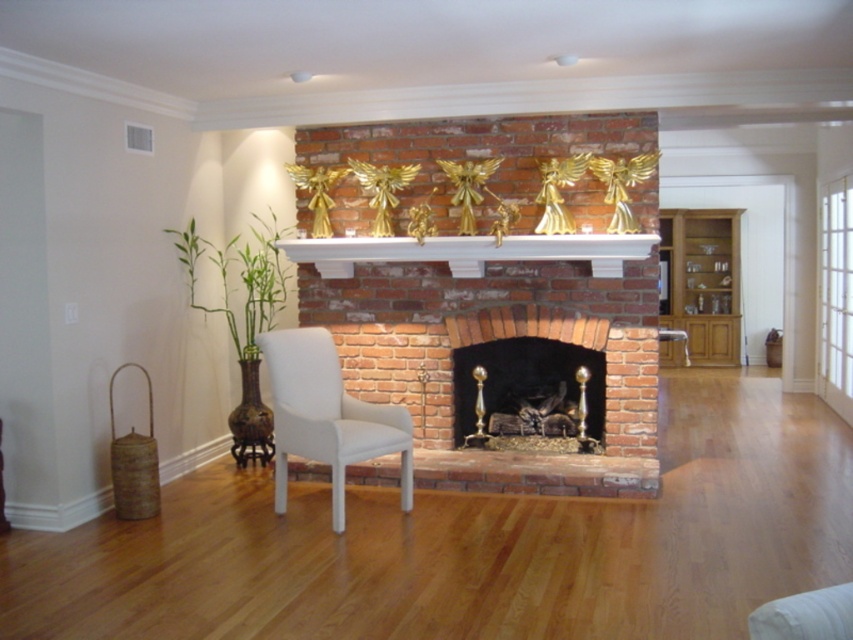
Question: Does brick fireplace at center have a larger size compared to white matte armchair at center?

Choices:
 (A) no
 (B) yes

Answer: (B)

Question: Which of the following is the farthest from the observer?

Choices:
 (A) white painted wood mantle at center
 (B) oak cabinet at right

Answer: (B)

Question: Is white matte armchair at center positioned at the back of white painted wood mantle at center?

Choices:
 (A) no
 (B) yes

Answer: (A)

Question: Which point is farther to the camera?

Choices:
 (A) (257, 240)
 (B) (294, 420)

Answer: (A)

Question: Does white matte armchair at center come behind white painted wood mantle at center?

Choices:
 (A) yes
 (B) no

Answer: (B)

Question: Which is nearer to the green bamboo at center?

Choices:
 (A) white painted wood mantle at center
 (B) brick fireplace at center
 (C) oak cabinet at right

Answer: (A)